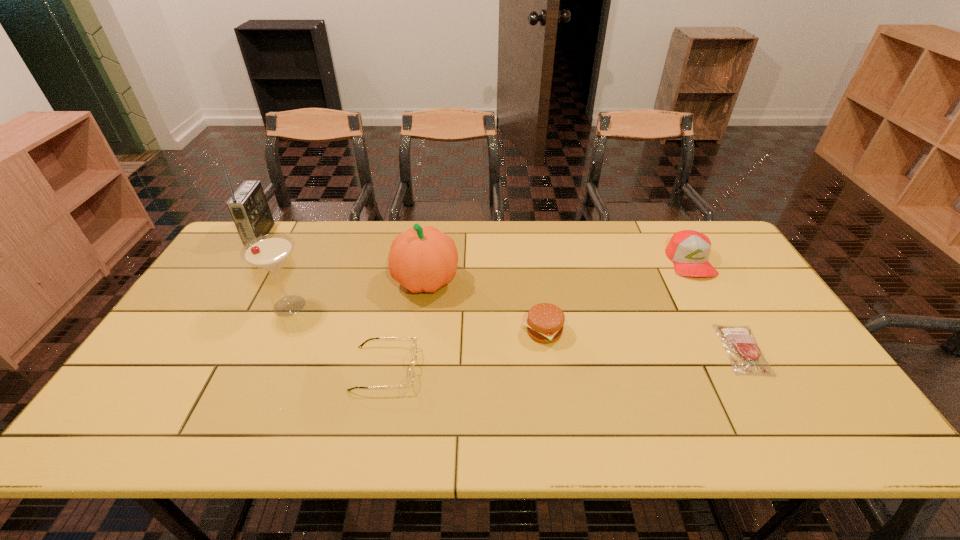
Where is `vacant point that satisfies the following two spatial constraints: 1. on the display of the leftmost object; 2. on the back side of the third shortest object`? The width and height of the screenshot is (960, 540). vacant point that satisfies the following two spatial constraints: 1. on the display of the leftmost object; 2. on the back side of the third shortest object is located at coordinates (199, 332).

Locate an element on the screen. Image resolution: width=960 pixels, height=540 pixels. free region that satisfies the following two spatial constraints: 1. on the back side of the steak; 2. on the display of the radio receiver is located at coordinates (677, 235).

Find the location of a particular element. This screenshot has height=540, width=960. vacant region that satisfies the following two spatial constraints: 1. on the display of the second object from left to right; 2. on the right side of the leftmost object is located at coordinates (215, 306).

Image resolution: width=960 pixels, height=540 pixels. Find the location of `vacant point that satisfies the following two spatial constraints: 1. on the back side of the second object from left to right; 2. on the left side of the pumpkin`. vacant point that satisfies the following two spatial constraints: 1. on the back side of the second object from left to right; 2. on the left side of the pumpkin is located at coordinates (301, 281).

Locate an element on the screen. Image resolution: width=960 pixels, height=540 pixels. blank area in the image that satisfies the following two spatial constraints: 1. on the front side of the pumpkin; 2. on the left side of the third shortest object is located at coordinates (419, 332).